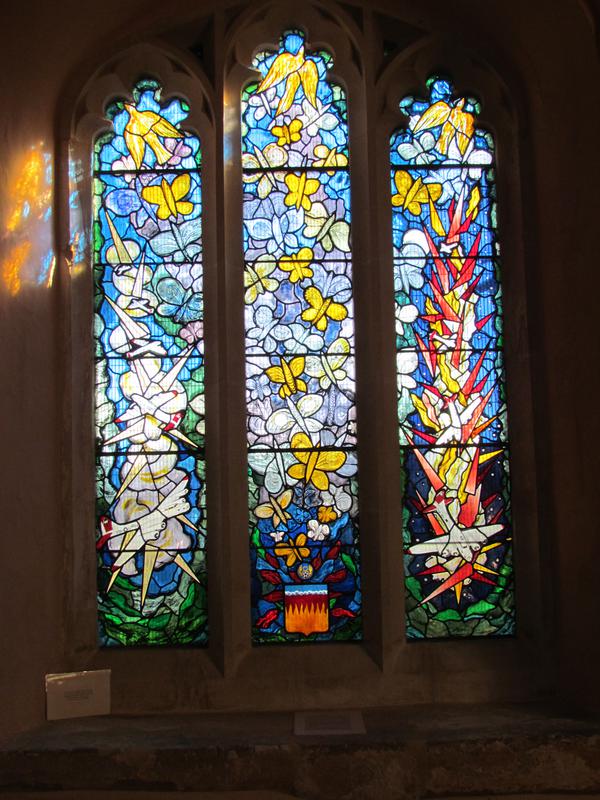
Where is `brown wall`? The width and height of the screenshot is (600, 800). brown wall is located at coordinates (34, 96).